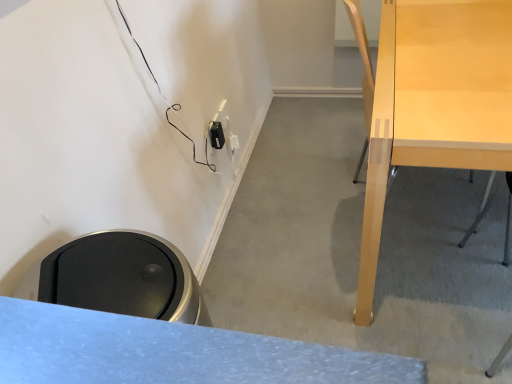
At what (x,y) coordinates should I click in order to perform the action: click on free space that is to the left of light wood desk at right. Please return your answer as a coordinate pair (x, y). This screenshot has width=512, height=384. Looking at the image, I should click on [x=286, y=250].